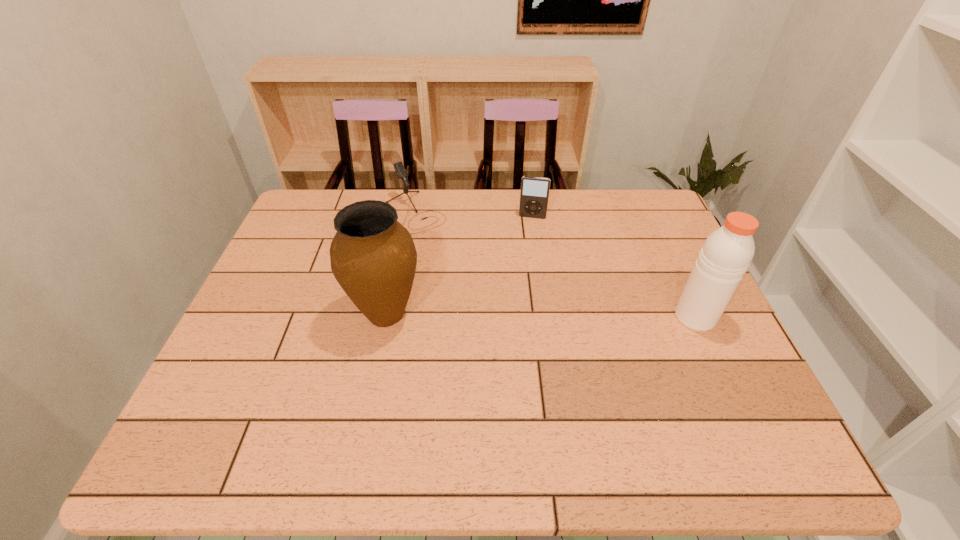
Where is `free space on the desktop that is between the urn and the shaker and is positioned on the front-facing side of the iPod`? free space on the desktop that is between the urn and the shaker and is positioned on the front-facing side of the iPod is located at coordinates (517, 315).

Where is `free space on the desktop that is between the urn and the rightmost object and is positioned on the stand of the microphone`? This screenshot has width=960, height=540. free space on the desktop that is between the urn and the rightmost object and is positioned on the stand of the microphone is located at coordinates (512, 315).